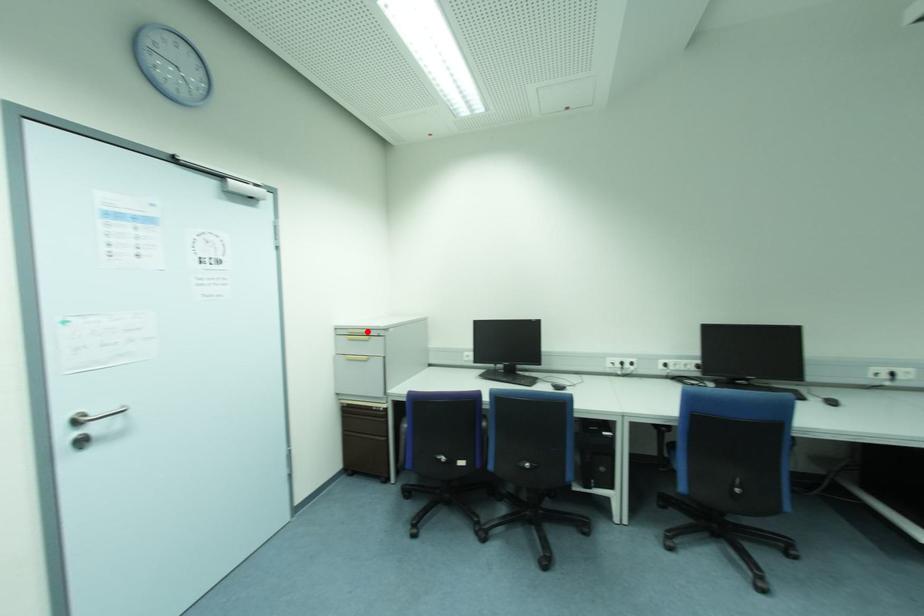
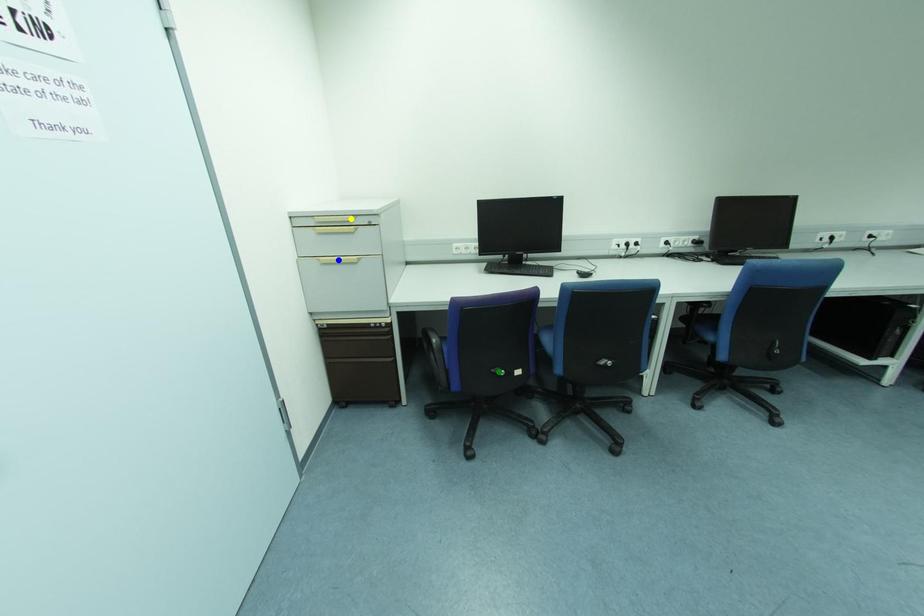
Question: I am providing you with two images of the same scene from different viewpoints. A red point is marked on the first image. You are given multiple points on the second image. Which mark in image 2 goes with the point in image 1?

Choices:
 (A) yellow point
 (B) blue point
 (C) green point

Answer: (A)